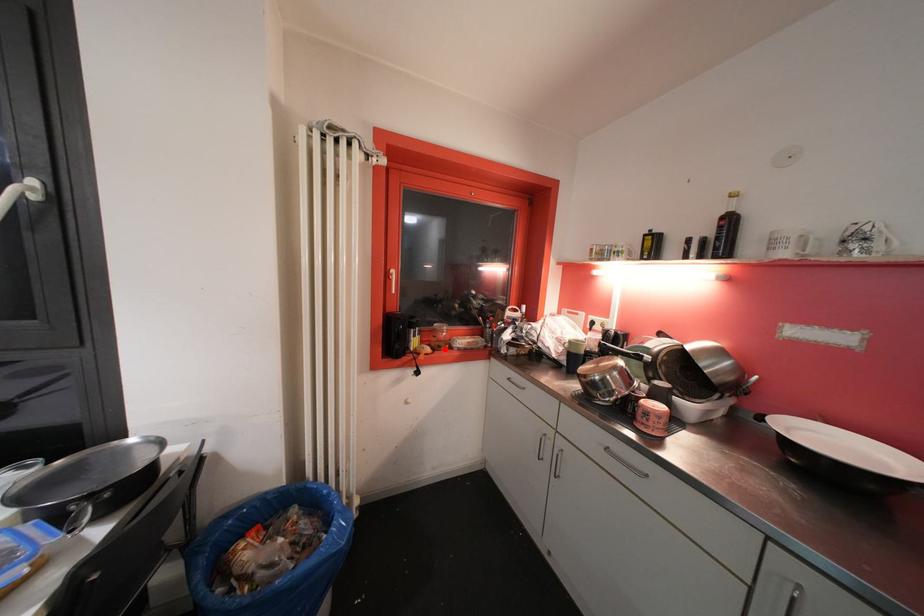
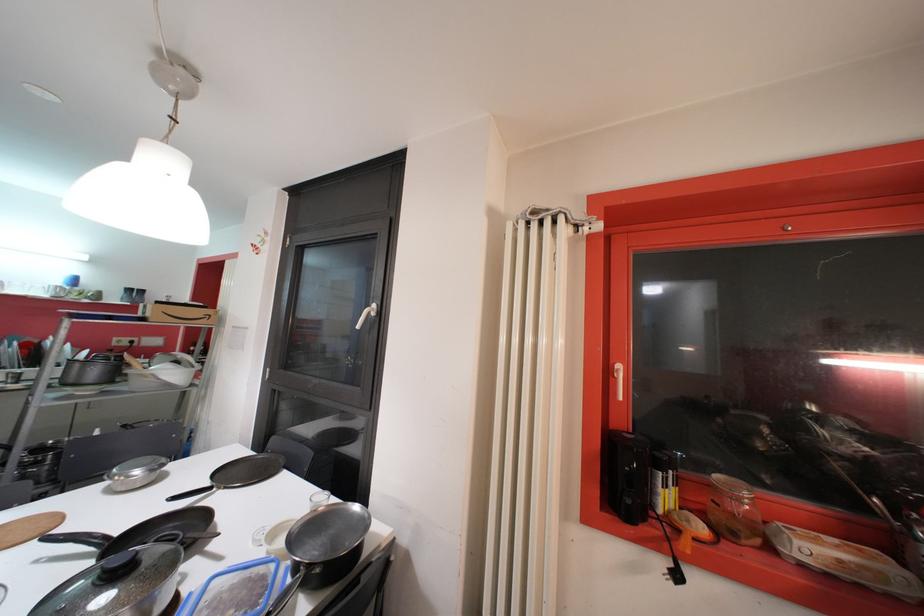
Question: I am providing you with two images of the same scene from different viewpoints. Image1 has a red point marked. In image2, the corresponding 3D location appears at what relative position? Reply with the corresponding letter.

Choices:
 (A) Closer
 (B) Farther

Answer: (A)